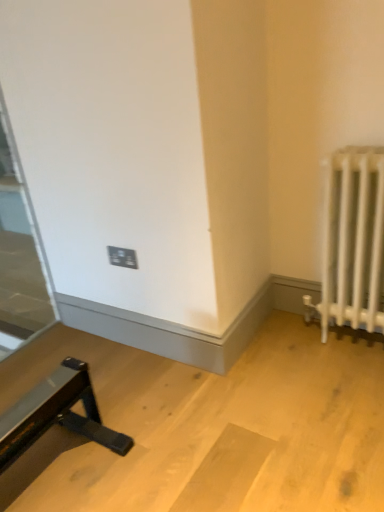
Locate an element on the screen. The height and width of the screenshot is (512, 384). free point in front of transparent glass door at left is located at coordinates (31, 359).